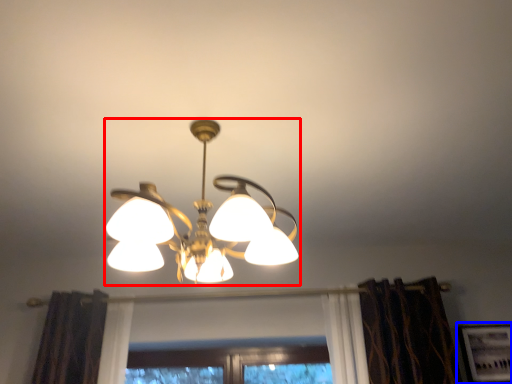
Question: Among these objects, which one is farthest to the camera, lamp (highlighted by a red box) or picture frame (highlighted by a blue box)?

Choices:
 (A) lamp
 (B) picture frame

Answer: (B)